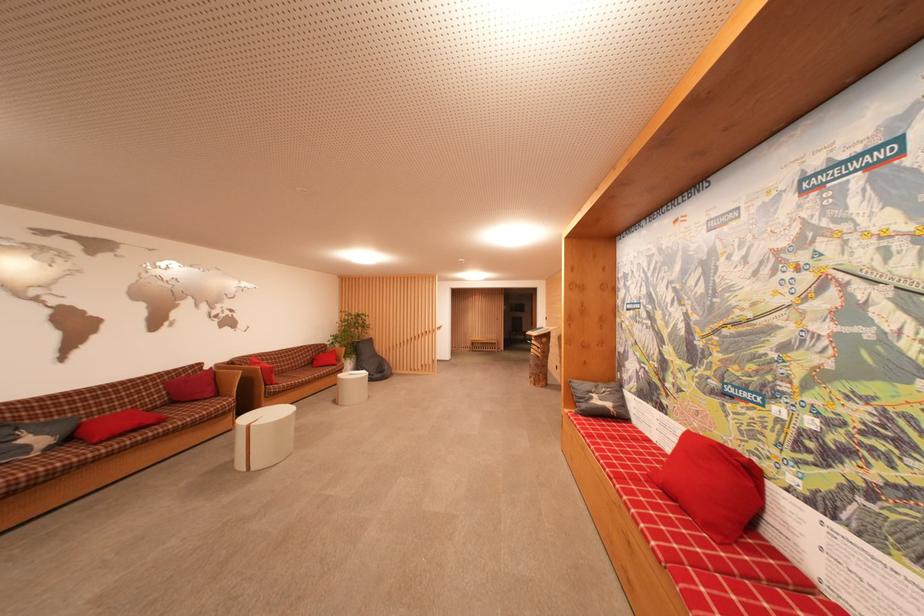
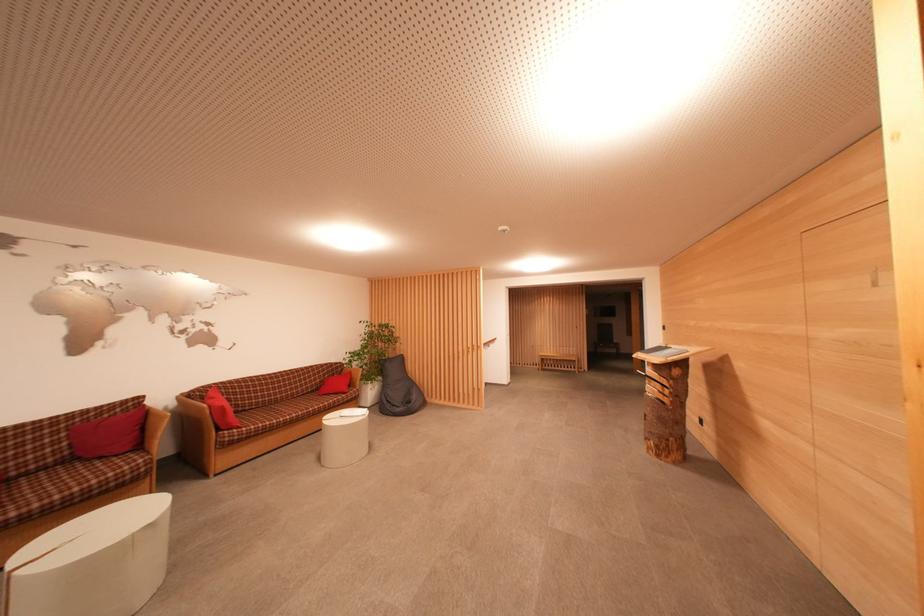
In the second image, find the point that corresponds to pixel 159 411 in the first image.

(45, 472)